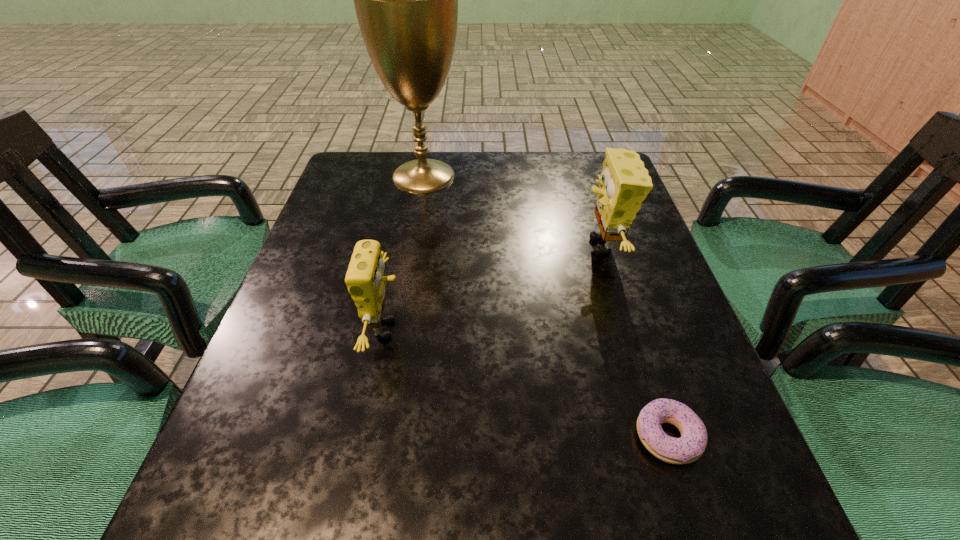
The image size is (960, 540). I want to click on vacant area situated on the face of the right sponge, so click(476, 246).

The image size is (960, 540). I want to click on free space located 0.080m on the face of the left sponge, so click(447, 329).

You are a GUI agent. You are given a task and a screenshot of the screen. Output one action in this format:
    pyautogui.click(x=<x>, y=<y>)
    Task: Click on the vacant point located 0.400m on the left of the doughnut
    This screenshot has width=960, height=540.
    Given the screenshot: What is the action you would take?
    pyautogui.click(x=378, y=437)

Locate an element on the screen. Image resolution: width=960 pixels, height=540 pixels. object present at the far edge is located at coordinates (406, 0).

You are a GUI agent. You are given a task and a screenshot of the screen. Output one action in this format:
    pyautogui.click(x=<x>, y=<y>)
    Task: Click on the object at the left edge
    This screenshot has height=540, width=960.
    Given the screenshot: What is the action you would take?
    pyautogui.click(x=406, y=0)

I want to click on sponge that is at the right edge, so click(x=624, y=183).

Where is `doughnut located at the right edge`? Image resolution: width=960 pixels, height=540 pixels. doughnut located at the right edge is located at coordinates (693, 442).

At what (x,y) coordinates should I click in order to perform the action: click on object located in the far left corner section of the desktop. Please return your answer as a coordinate pair (x, y). Looking at the image, I should click on (406, 0).

In order to click on free location at the far edge of the desktop in this screenshot , I will do `click(532, 153)`.

Locate an element on the screen. free space at the near edge of the desktop is located at coordinates (457, 491).